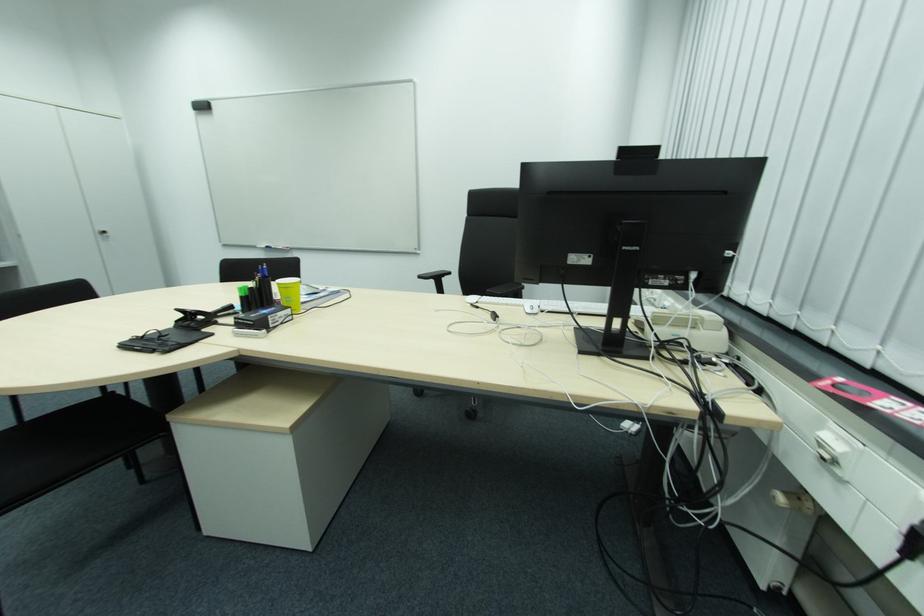
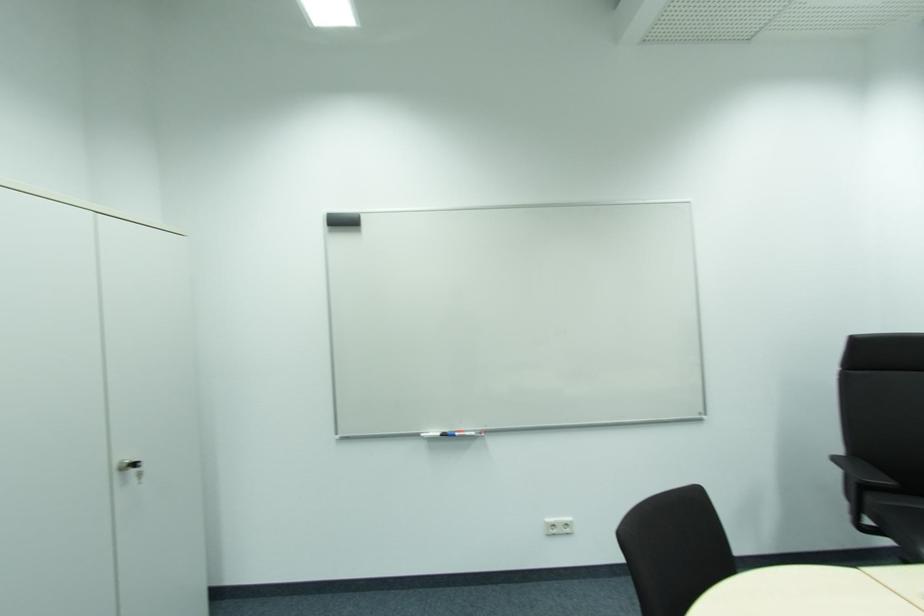
In the second image, find the point that corresponds to pixel 280 248 in the first image.

(464, 434)